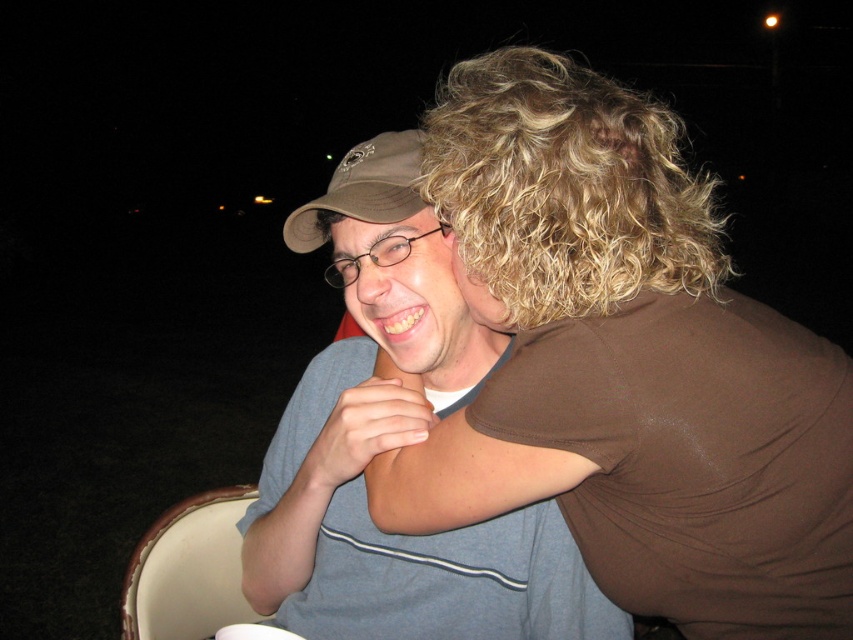
You are a photographer at a nighttime event. You want to capture a candid shot of the two people wearing the brown matte shirt at upper right and the matte gray shirt at center. The camera has a 50cm focal length lens. Will the subjects be within the lens range to be captured in a single frame?

The brown matte shirt at upper right is 21.79 centimeters away from the matte gray shirt at center. Since the distance between them is less than the 50cm focal length, they can be captured in a single frame.